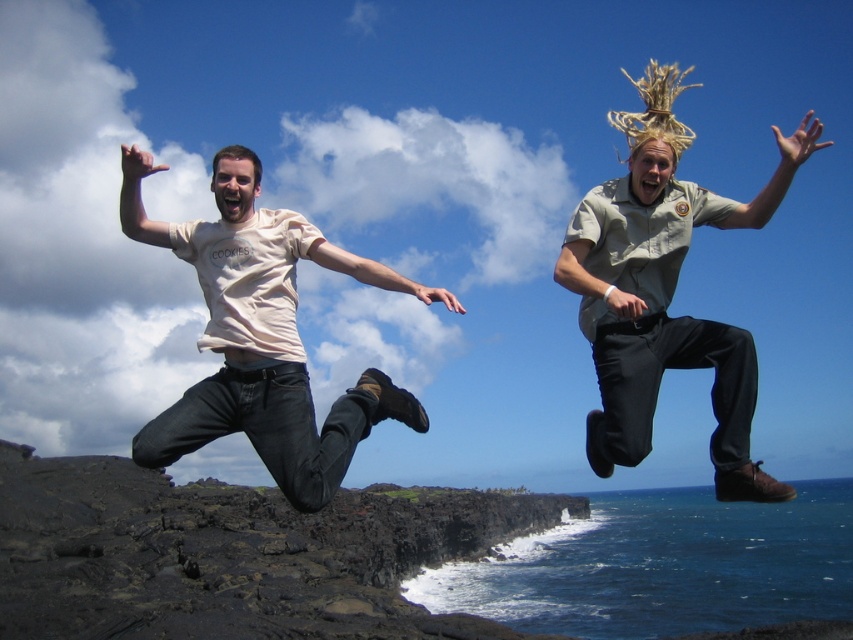
Question: Among these objects, which one is nearest to the camera?

Choices:
 (A) khaki uniform at right
 (B) matte beige t-shirt at left

Answer: (B)

Question: Which object is closer to the camera taking this photo?

Choices:
 (A) black volcanic rock at lower left
 (B) matte beige t-shirt at left

Answer: (B)

Question: Is black volcanic rock at lower left wider than matte beige t-shirt at left?

Choices:
 (A) no
 (B) yes

Answer: (B)

Question: Among these points, which one is nearest to the camera?

Choices:
 (A) (341, 604)
 (B) (689, 328)

Answer: (B)

Question: Is khaki uniform at right smaller than matte beige t-shirt at left?

Choices:
 (A) yes
 (B) no

Answer: (B)

Question: From the image, what is the correct spatial relationship of black volcanic rock at lower left in relation to khaki uniform at right?

Choices:
 (A) below
 (B) above

Answer: (A)